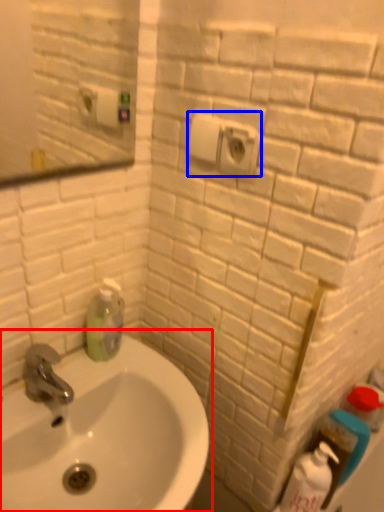
Question: Which of the following is the farthest to the observer, sink (highlighted by a red box) or electric outlet (highlighted by a blue box)?

Choices:
 (A) sink
 (B) electric outlet

Answer: (B)